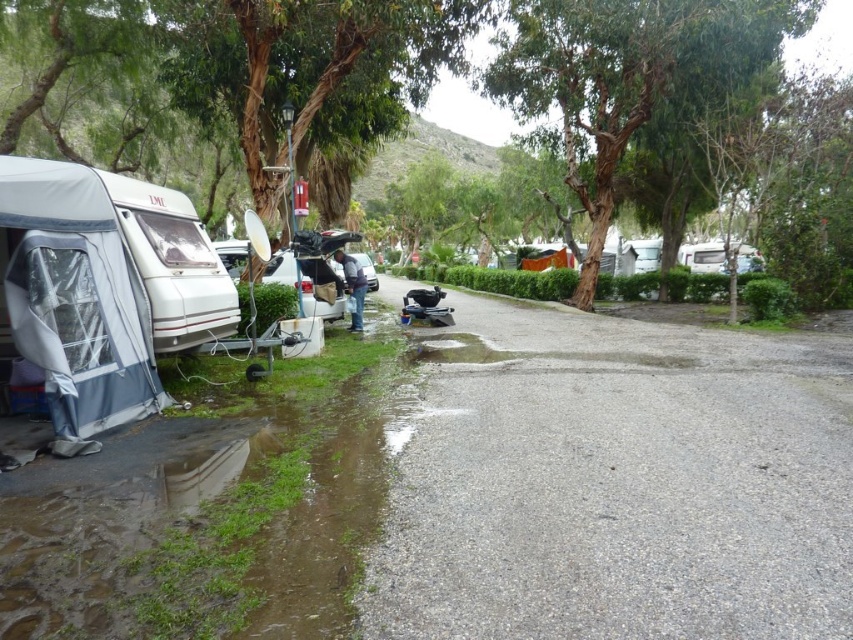
You are a hiker who just arrived at the camping area. You see the white fabric tent at left and the metallic silver car at center. Which object is closer to the gravel pathway leading through the grassy area?

The white fabric tent at left is closer to the gravel pathway leading through the grassy area because it is positioned to the left of the metallic silver car at center, which is further away from the pathway.

From the picture: You are a hiker planning to set up a tent. You have a white fabric tent at left and a metallic silver car at center in your view. Which object is closer to you according to the spatial arrangement?

The white fabric tent at left is closer to you since it is in front of the metallic silver car at center.

You are standing at the lower left corner of the image. You want to walk to the green rough bark tree at upper center. Which direction should you head?

You should head northeast to reach the green rough bark tree at upper center because its 2D coordinates are at point (x=628, y=77), which is northeast from the lower left corner.